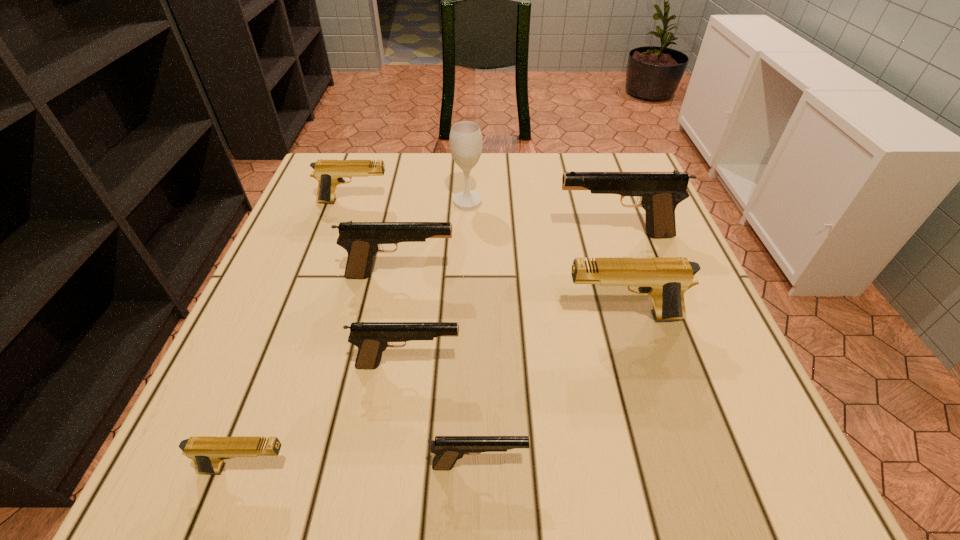
Where is `wineglass`? wineglass is located at coordinates (465, 140).

Identify the location of the second farthest pistol. Image resolution: width=960 pixels, height=540 pixels. (659, 192).

At what (x,y) coordinates should I click in order to perform the action: click on the third farthest object. Please return your answer as a coordinate pair (x, y). Looking at the image, I should click on (659, 192).

At what (x,y) coordinates should I click in order to perform the action: click on the fifth farthest object. Please return your answer as a coordinate pair (x, y). The width and height of the screenshot is (960, 540). Looking at the image, I should click on (666, 280).

The image size is (960, 540). In order to click on the biggest tan pistol in this screenshot , I will do `click(666, 280)`.

Identify the location of the fifth nearest pistol. The image size is (960, 540). (362, 240).

The width and height of the screenshot is (960, 540). I want to click on the second biggest black pistol, so click(362, 240).

You are a GUI agent. You are given a task and a screenshot of the screen. Output one action in this format:
    pyautogui.click(x=<x>, y=<y>)
    Task: Click on the second biggest tan pistol
    
    Given the screenshot: What is the action you would take?
    (x=328, y=173)

You are a GUI agent. You are given a task and a screenshot of the screen. Output one action in this format:
    pyautogui.click(x=<x>, y=<y>)
    Task: Click on the farthest tan pistol
    The image size is (960, 540).
    Given the screenshot: What is the action you would take?
    pyautogui.click(x=328, y=173)

Identify the location of the fifth farthest pistol. The image size is (960, 540). click(372, 338).